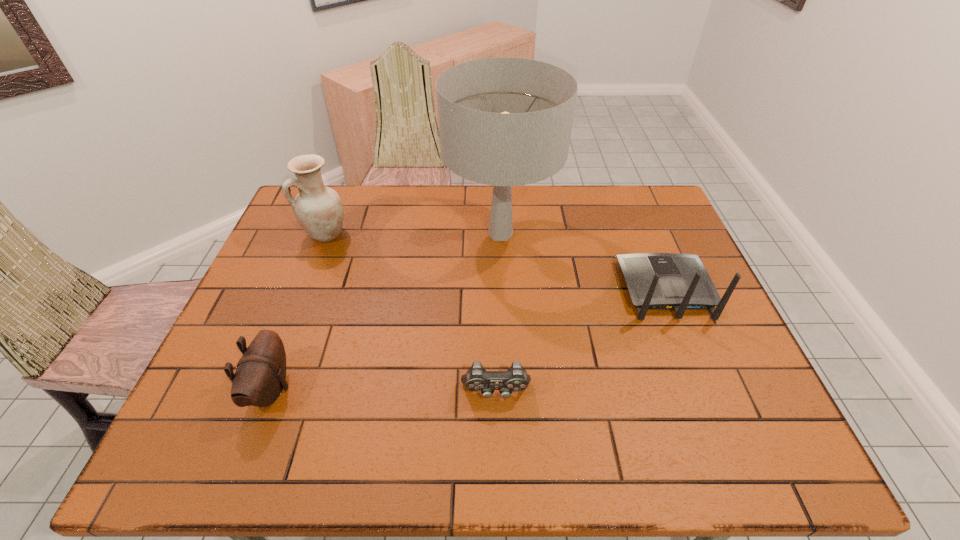
Locate an element on the screen. The width and height of the screenshot is (960, 540). free location located on the front-facing side of the router is located at coordinates (645, 240).

Identify the location of vacant space located 0.180m on the front-facing side of the router. The image size is (960, 540). (638, 224).

In order to click on free space located 0.100m with the flap open on the pouch in this screenshot , I will do `click(334, 389)`.

Where is `vacant space located 0.050m on the surface of the control with buttons`? This screenshot has width=960, height=540. vacant space located 0.050m on the surface of the control with buttons is located at coordinates (497, 427).

Locate an element on the screen. lampshade that is positioned at the far edge is located at coordinates (503, 121).

Find the location of a particular element. This screenshot has width=960, height=540. pottery situated at the far edge is located at coordinates (318, 209).

Locate an element on the screen. pottery at the left edge is located at coordinates (318, 209).

Where is `pouch present at the left edge`? The image size is (960, 540). pouch present at the left edge is located at coordinates (260, 377).

At what (x,y) coordinates should I click in order to perform the action: click on object that is at the right edge. Please return your answer as a coordinate pair (x, y). This screenshot has width=960, height=540. Looking at the image, I should click on (656, 281).

Identify the location of object that is positioned at the far left corner. (318, 209).